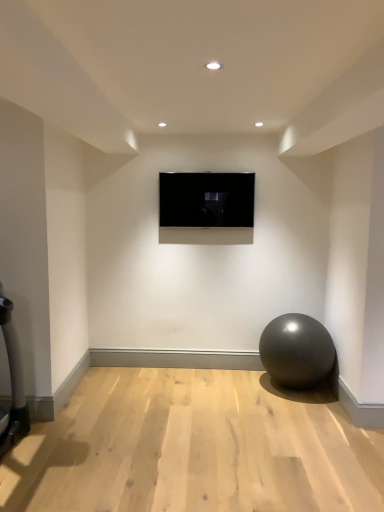
What is the approximate width of matte black screen at center?

The width of matte black screen at center is 3.30 inches.

What is the approximate height of matte black screen at center?

matte black screen at center is 21.37 inches in height.

What do you see at coordinates (206, 199) in the screenshot?
I see `matte black screen at center` at bounding box center [206, 199].

Locate an element on the screen. The height and width of the screenshot is (512, 384). matte black screen at center is located at coordinates (206, 199).

Locate an element on the screen. matte gray ball at lower right is located at coordinates (297, 350).

The width and height of the screenshot is (384, 512). Describe the element at coordinates (297, 350) in the screenshot. I see `matte gray ball at lower right` at that location.

Find the location of a particular element. The width and height of the screenshot is (384, 512). matte black screen at center is located at coordinates click(x=206, y=199).

Between matte gray ball at lower right and matte black screen at center, which one appears on the left side from the viewer's perspective?

matte black screen at center is more to the left.

Is matte gray ball at lower right closer to the viewer compared to matte black screen at center?

Yes, it is in front of matte black screen at center.

Does point (264, 341) lie in front of point (214, 176)?

Yes, point (264, 341) is in front of point (214, 176).

From the image's perspective, which object appears higher, matte gray ball at lower right or matte black screen at center?

matte black screen at center.

From a real-world perspective, is matte gray ball at lower right on top of matte black screen at center?

Incorrect, from a real-world perspective, matte gray ball at lower right is lower than matte black screen at center.

Is matte gray ball at lower right wider than matte black screen at center?

Indeed, matte gray ball at lower right has a greater width compared to matte black screen at center.

In terms of height, does matte gray ball at lower right look taller or shorter compared to matte black screen at center?

In the image, matte gray ball at lower right appears to be taller than matte black screen at center.

Is matte gray ball at lower right smaller than matte black screen at center?

No.

Choose the correct answer: Is matte gray ball at lower right inside matte black screen at center or outside it?

matte gray ball at lower right cannot be found inside matte black screen at center.

Is matte gray ball at lower right far away from matte black screen at center?

Yes, matte gray ball at lower right and matte black screen at center are quite far apart.

Is matte black screen at center at the back of matte gray ball at lower right?

No, matte gray ball at lower right is not facing away from matte black screen at center.

Based on the photo, how different are the orientations of matte gray ball at lower right and matte black screen at center in degrees?

The angle between the facing direction of matte gray ball at lower right and the facing direction of matte black screen at center is 1.16 degrees.

In the image, there is a matte black screen at center. Find the location of `ball below it (from a real-world perspective)`. ball below it (from a real-world perspective) is located at coordinates (297, 350).

Visually, is matte black screen at center positioned to the left or to the right of matte gray ball at lower right?

Based on their positions, matte black screen at center is located to the left of matte gray ball at lower right.

Considering their positions, is matte black screen at center located in front of or behind matte gray ball at lower right?

Clearly, matte black screen at center is behind matte gray ball at lower right.

Does point (220, 195) come behind point (273, 375)?

Yes, it is behind point (273, 375).

From the image's perspective, between matte black screen at center and matte gray ball at lower right, which one is located above?

matte black screen at center.

From a real-world perspective, does matte black screen at center stand above matte gray ball at lower right?

Correct, in the physical world, matte black screen at center is higher than matte gray ball at lower right.

Considering the sizes of objects matte black screen at center and matte gray ball at lower right in the image provided, who is thinner, matte black screen at center or matte gray ball at lower right?

matte black screen at center is thinner.

Who is shorter, matte black screen at center or matte gray ball at lower right?

matte black screen at center.

Who is smaller, matte black screen at center or matte gray ball at lower right?

With smaller size is matte black screen at center.

Which is correct: matte black screen at center is inside matte gray ball at lower right, or outside of it?

matte black screen at center is located beyond the bounds of matte gray ball at lower right.

Is matte black screen at center with matte gray ball at lower right?

matte black screen at center and matte gray ball at lower right are clearly separated.

Is matte black screen at center oriented away from matte gray ball at lower right?

matte black screen at center is not turned away from matte gray ball at lower right.

How different are the orientations of matte black screen at center and matte gray ball at lower right in degrees?

1.16 degrees.

The image size is (384, 512). Find the location of `ball in front of the matte black screen at center`. ball in front of the matte black screen at center is located at coordinates (297, 350).

The width and height of the screenshot is (384, 512). I want to click on television above the matte gray ball at lower right (from a real-world perspective), so click(x=206, y=199).

Where is `television behind the matte gray ball at lower right`? The width and height of the screenshot is (384, 512). television behind the matte gray ball at lower right is located at coordinates click(206, 199).